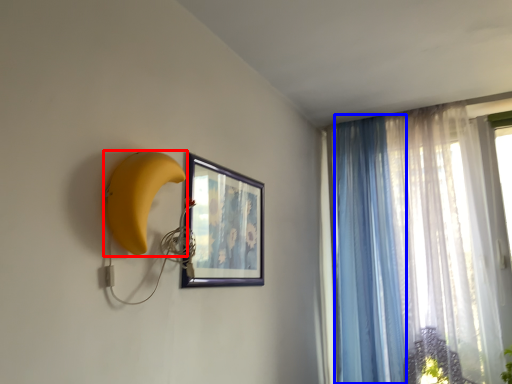
Question: Which object is closer to the camera taking this photo, banana (highlighted by a red box) or curtain (highlighted by a blue box)?

Choices:
 (A) banana
 (B) curtain

Answer: (A)